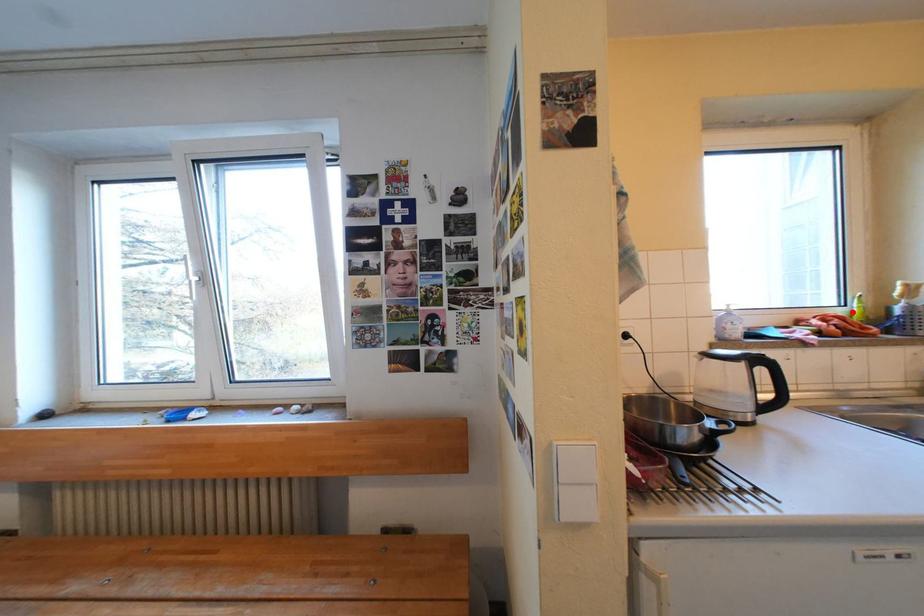
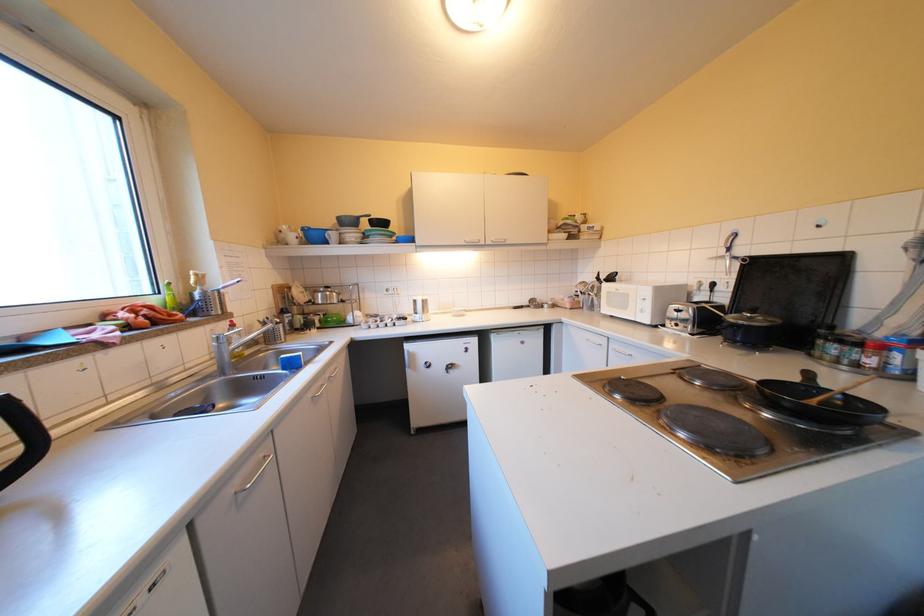
In the second image, find the point that corresponds to the highlighted location in the first image.

(167, 300)